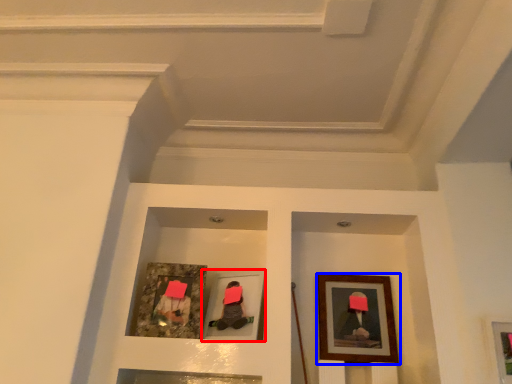
Question: Which of the following is the closest to the observer, picture frame (highlighted by a red box) or picture frame (highlighted by a blue box)?

Choices:
 (A) picture frame
 (B) picture frame

Answer: (A)